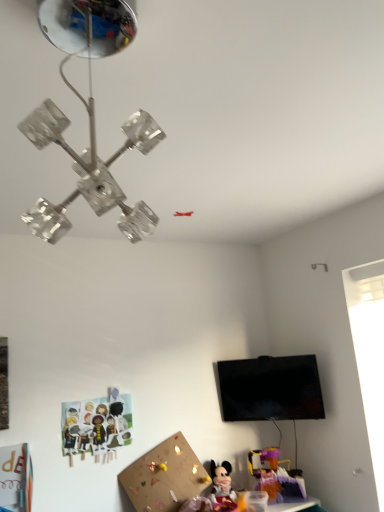
Question: Is point (132, 217) closer or farther from the camera than point (266, 457)?

Choices:
 (A) farther
 (B) closer

Answer: (B)

Question: From the image's perspective, is clear glass chandelier at upper center located above or below plastic purple toy at lower right, the 1th toy positioned from the right?

Choices:
 (A) above
 (B) below

Answer: (A)

Question: Based on their relative distances, which object is farther from the clear glass chandelier at upper center?

Choices:
 (A) plastic purple toy at lower right, the 1th toy positioned from the right
 (B) translucent plastic table at lower right
 (C) black glossy tv at upper right
 (D) matte plastic minnie mouse at lower center, the second toy positioned from the left
 (E) paper cutout characters at lower left, which is counted as the 1th toy, starting from the left

Answer: (B)

Question: Which of these objects is positioned farthest from the translucent plastic table at lower right?

Choices:
 (A) plastic purple toy at lower right, the third toy when ordered from left to right
 (B) black glossy tv at upper right
 (C) paper cutout characters at lower left, which is counted as the 1th toy, starting from the left
 (D) clear glass chandelier at upper center
 (E) matte plastic minnie mouse at lower center, the second toy positioned from the left

Answer: (D)